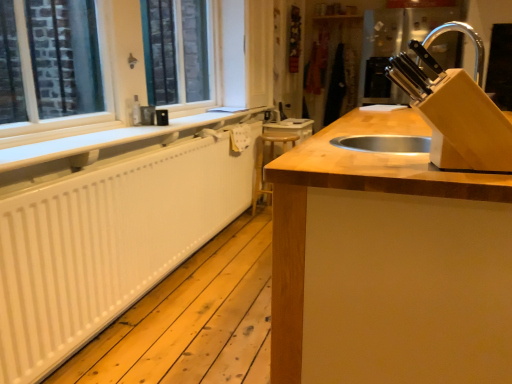
Question: Is wooden at center at the right side of white matte radiator at left?

Choices:
 (A) no
 (B) yes

Answer: (B)

Question: Is wooden at center outside of white matte radiator at left?

Choices:
 (A) no
 (B) yes

Answer: (B)

Question: Can you confirm if wooden at center is bigger than white matte radiator at left?

Choices:
 (A) no
 (B) yes

Answer: (B)

Question: Is wooden at center next to white matte radiator at left?

Choices:
 (A) no
 (B) yes

Answer: (A)

Question: Is wooden at center oriented away from white matte radiator at left?

Choices:
 (A) no
 (B) yes

Answer: (B)

Question: From the image's perspective, relative to wooden at center, is wooden at center above or below?

Choices:
 (A) below
 (B) above

Answer: (B)

Question: Considering the positions of wooden at center and wooden at center in the image, is wooden at center wider or thinner than wooden at center?

Choices:
 (A) wide
 (B) thin

Answer: (B)

Question: Is wooden at center taller or shorter than wooden at center?

Choices:
 (A) tall
 (B) short

Answer: (B)

Question: Visually, is wooden at center positioned to the left or to the right of wooden at center?

Choices:
 (A) right
 (B) left

Answer: (B)

Question: In the image, is white matte radiator at left positioned in front of or behind wooden at center?

Choices:
 (A) behind
 (B) front

Answer: (A)

Question: From the image's perspective, is white matte radiator at left positioned above or below wooden at center?

Choices:
 (A) below
 (B) above

Answer: (B)

Question: Based on their positions, is white matte radiator at left located to the left or right of wooden at center?

Choices:
 (A) left
 (B) right

Answer: (A)

Question: From their relative heights in the image, would you say white matte radiator at left is taller or shorter than wooden at center?

Choices:
 (A) short
 (B) tall

Answer: (A)

Question: Is white matte radiator at left situated inside white painted wood at left or outside?

Choices:
 (A) outside
 (B) inside

Answer: (A)

Question: Considering the positions of point (98, 145) and point (25, 107), is point (98, 145) closer or farther from the camera than point (25, 107)?

Choices:
 (A) farther
 (B) closer

Answer: (B)